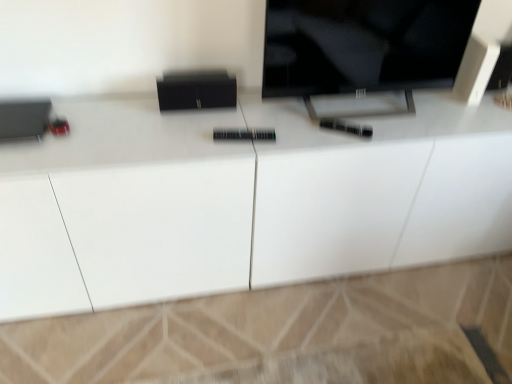
Find the location of a particular element. Image resolution: width=512 pixels, height=384 pixels. free point below black glossy tv at upper center (from a real-world perspective) is located at coordinates (364, 113).